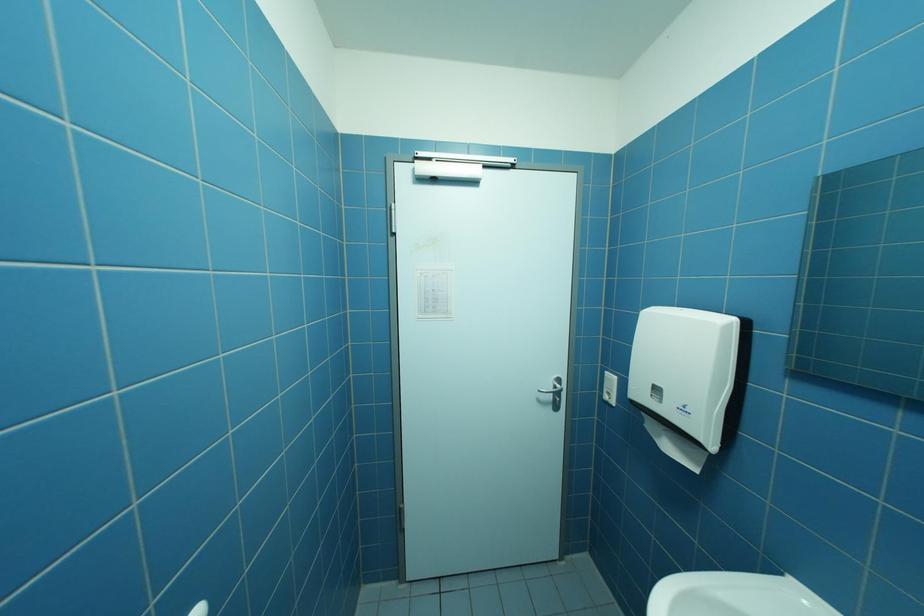
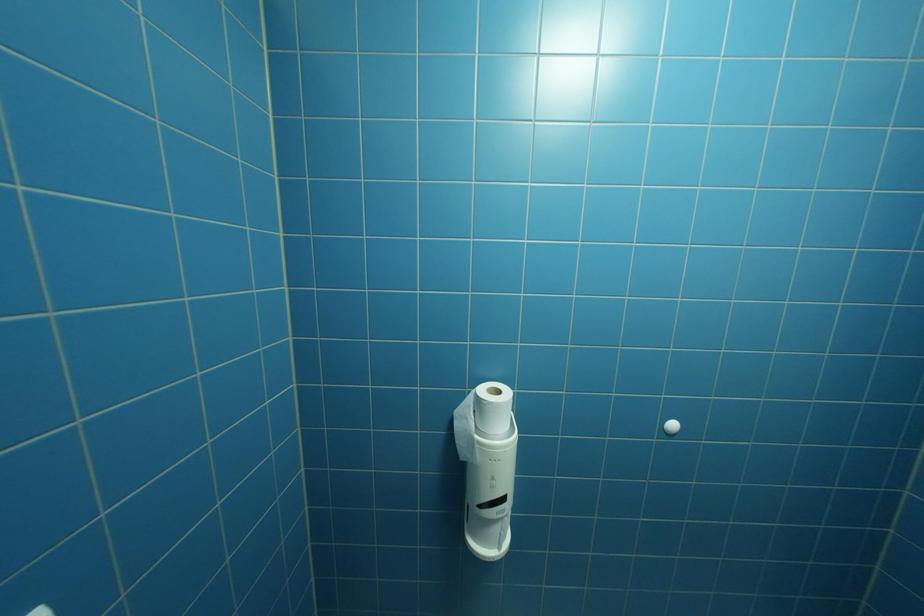
Question: Based on the continuous images, in which direction is the camera rotating? Reply with the corresponding letter.

Choices:
 (A) Left
 (B) Right
 (C) Up
 (D) Down

Answer: (A)